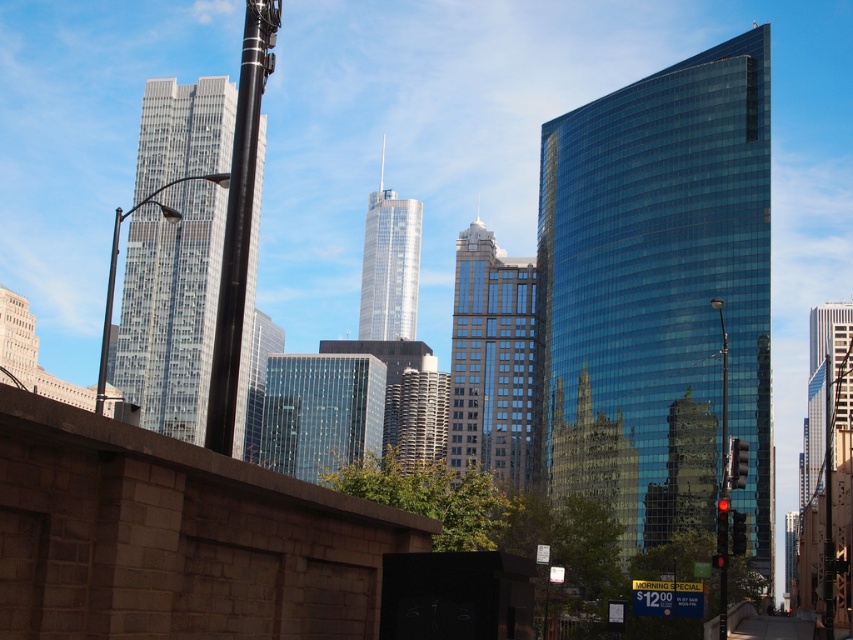
Can you confirm if clear glass skyscraper at center is shorter than metallic traffic light at right?

No, clear glass skyscraper at center is not shorter than metallic traffic light at right.

Which is below, clear glass skyscraper at center or metallic traffic light at right?

clear glass skyscraper at center is below.

Between point (347, 401) and point (722, 476), which one is positioned behind?

Positioned behind is point (347, 401).

Where is `clear glass skyscraper at center`? clear glass skyscraper at center is located at coordinates (320, 412).

Is glassy reflective skyscraper at center wider than black polished metal pole at left?

Yes, glassy reflective skyscraper at center is wider than black polished metal pole at left.

Can you confirm if glassy reflective skyscraper at center is thinner than black polished metal pole at left?

No.

Is point (508, 284) less distant than point (254, 81)?

No, it is behind (254, 81).

At what (x,y) coordinates should I click in order to perform the action: click on glassy reflective skyscraper at center. Please return your answer as a coordinate pair (x, y). Looking at the image, I should click on (492, 358).

Who is positioned more to the left, shiny glass skyscraper at center or metallic traffic light at right?

metallic traffic light at right is more to the left.

Who is taller, shiny glass skyscraper at center or metallic traffic light at right?

shiny glass skyscraper at center is taller.

This screenshot has height=640, width=853. What do you see at coordinates (659, 296) in the screenshot?
I see `shiny glass skyscraper at center` at bounding box center [659, 296].

Where is `shiny glass skyscraper at center`? shiny glass skyscraper at center is located at coordinates (659, 296).